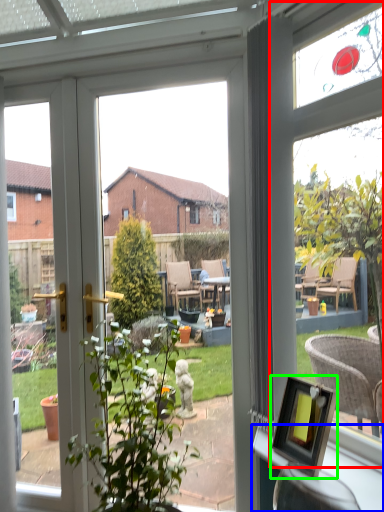
Question: Estimate the real-world distances between objects in this image. Which object is farther from bay window (highlighted by a red box), window sill (highlighted by a blue box) or picture frame (highlighted by a green box)?

Choices:
 (A) window sill
 (B) picture frame

Answer: (A)